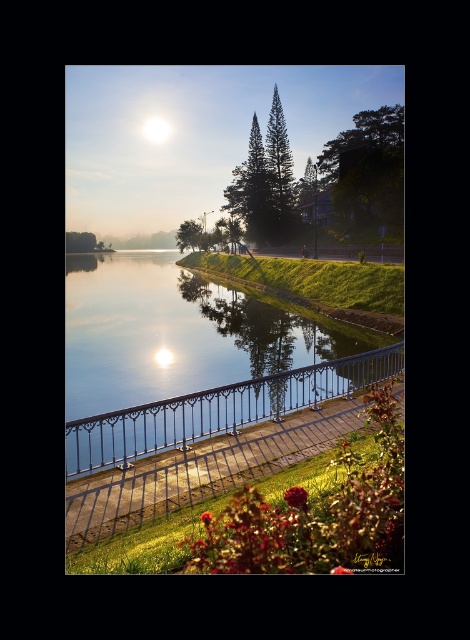
Which of these two, black wrought iron railing at lower center or white glossy moonlight at upper center, stands shorter?

black wrought iron railing at lower center is shorter.

Between black wrought iron railing at lower center and white glossy moonlight at upper center, which one is positioned higher?

Positioned higher is white glossy moonlight at upper center.

At what (x,y) coordinates should I click in order to perform the action: click on black wrought iron railing at lower center. Please return your answer as a coordinate pair (x, y). Looking at the image, I should click on (219, 410).